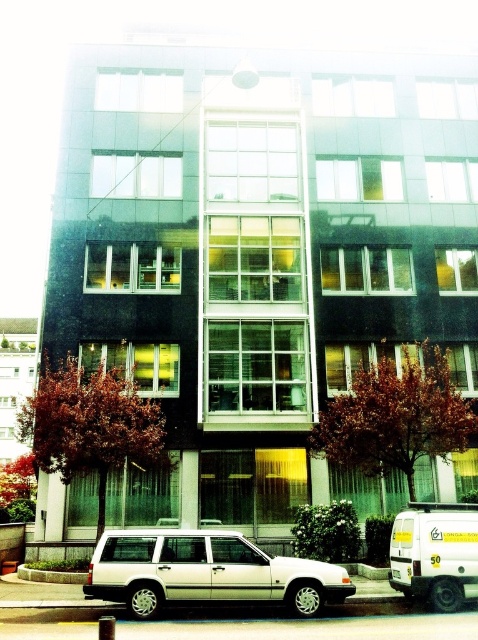
Question: Among these points, which one is nearest to the camera?

Choices:
 (A) (467, 532)
 (B) (151, 529)

Answer: (A)

Question: From the image, what is the correct spatial relationship of silver metallic station wagon at lower center in relation to white matte van at lower right?

Choices:
 (A) right
 (B) left

Answer: (B)

Question: Can you confirm if silver metallic station wagon at lower center is positioned to the right of white matte van at lower right?

Choices:
 (A) yes
 (B) no

Answer: (B)

Question: Is silver metallic station wagon at lower center below white matte van at lower right?

Choices:
 (A) yes
 (B) no

Answer: (A)

Question: Which point is farther to the camera?

Choices:
 (A) (406, 544)
 (B) (228, 582)

Answer: (A)

Question: Among these objects, which one is nearest to the camera?

Choices:
 (A) white matte van at lower right
 (B) silver metallic station wagon at lower center

Answer: (B)